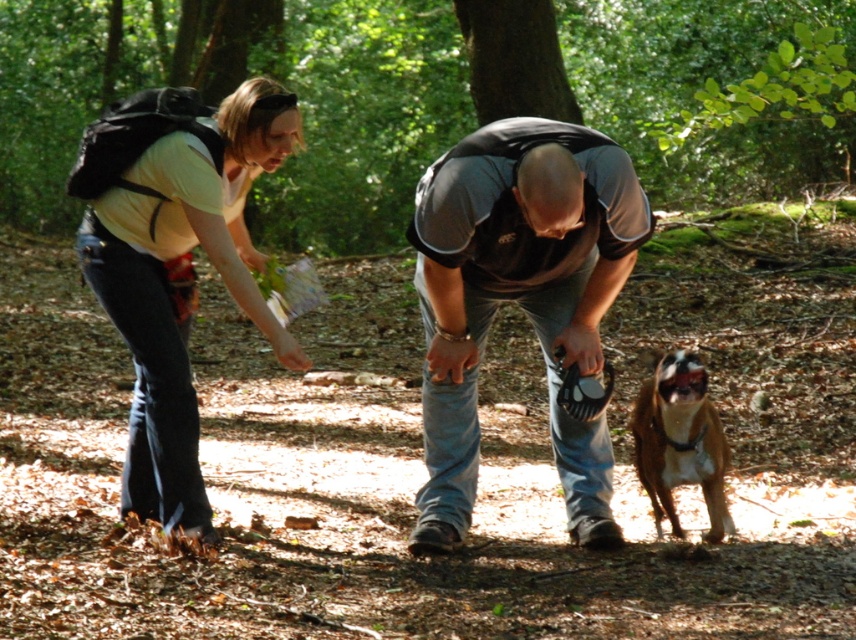
Question: Observing the image, what is the correct spatial positioning of matte yellow shirt at center in reference to brown fur dog at lower right?

Choices:
 (A) left
 (B) right

Answer: (A)

Question: Is dark gray mesh shirt at center below matte yellow shirt at center?

Choices:
 (A) no
 (B) yes

Answer: (B)

Question: Does dark gray mesh shirt at center have a greater width compared to brown fur dog at lower right?

Choices:
 (A) no
 (B) yes

Answer: (B)

Question: Which of these objects is positioned closest to the matte yellow shirt at center?

Choices:
 (A) brown fur dog at lower right
 (B) dark gray mesh shirt at center

Answer: (B)

Question: Which of the following is the farthest from the observer?

Choices:
 (A) (183, 138)
 (B) (464, 275)
 (C) (694, 406)

Answer: (B)

Question: Estimate the real-world distances between objects in this image. Which object is farther from the matte yellow shirt at center?

Choices:
 (A) brown fur dog at lower right
 (B) dark gray mesh shirt at center

Answer: (A)